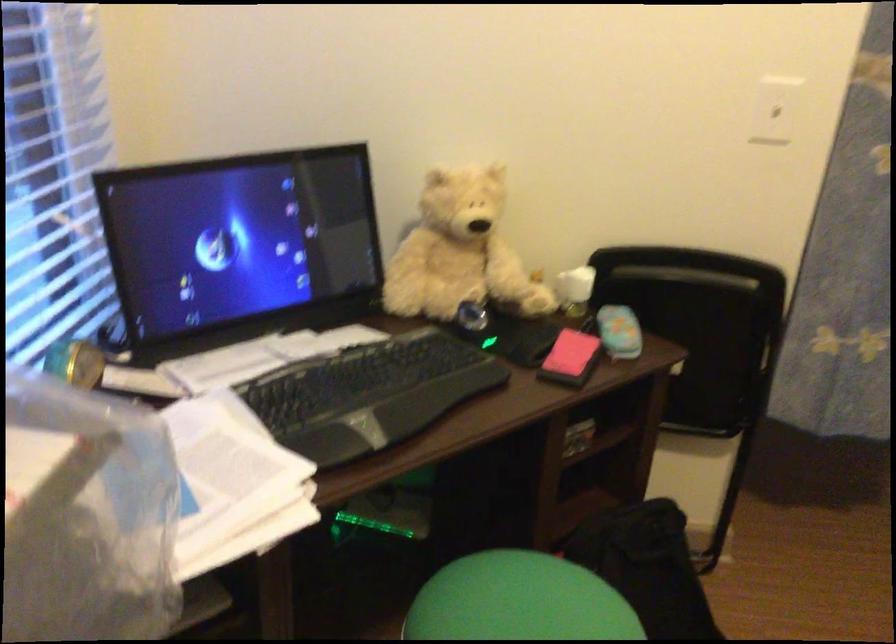
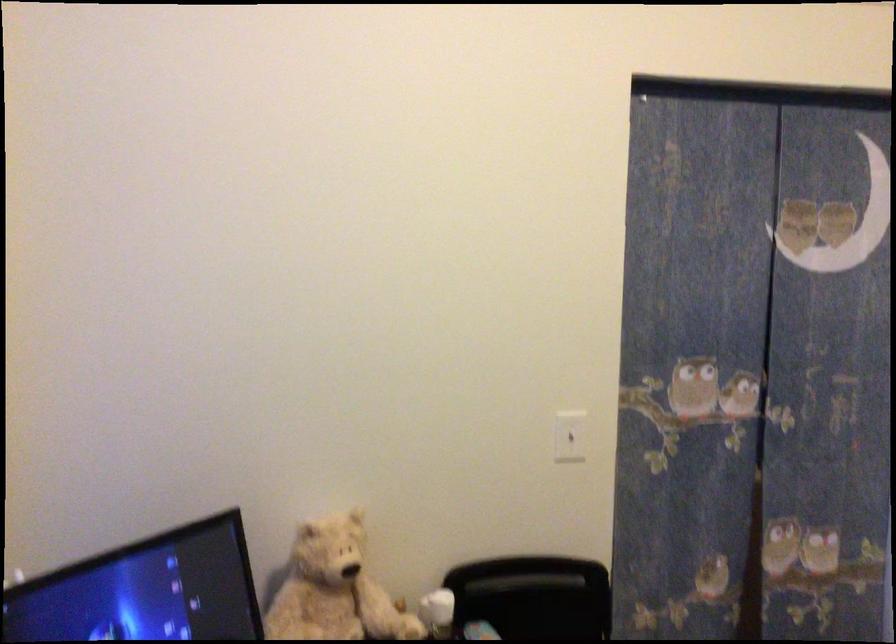
The point at (579,279) is marked in the first image. Where is the corresponding point in the second image?

(437, 612)